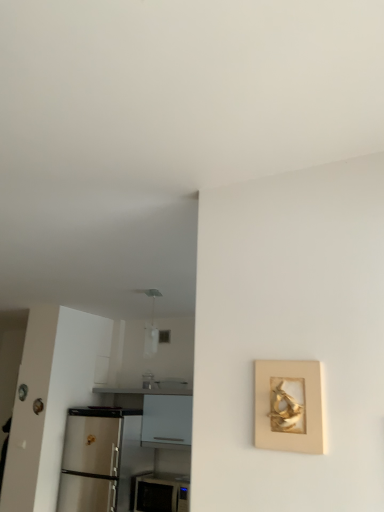
Question: Is gold textured frame at right bigger than white glossy counter at lower left?

Choices:
 (A) no
 (B) yes

Answer: (A)

Question: From the image's perspective, is gold textured frame at right on top of white glossy counter at lower left?

Choices:
 (A) yes
 (B) no

Answer: (A)

Question: Can you confirm if gold textured frame at right is positioned to the right of white glossy counter at lower left?

Choices:
 (A) no
 (B) yes

Answer: (B)

Question: Considering the relative sizes of gold textured frame at right and white glossy counter at lower left in the image provided, is gold textured frame at right wider than white glossy counter at lower left?

Choices:
 (A) no
 (B) yes

Answer: (A)

Question: Is gold textured frame at right positioned behind white glossy counter at lower left?

Choices:
 (A) no
 (B) yes

Answer: (A)

Question: Is gold textured frame at right positioned before white glossy counter at lower left?

Choices:
 (A) yes
 (B) no

Answer: (A)

Question: Is the surface of gold textured frame at right in direct contact with white glossy microwave at lower center?

Choices:
 (A) yes
 (B) no

Answer: (B)

Question: Is gold textured frame at right outside of white glossy microwave at lower center?

Choices:
 (A) no
 (B) yes

Answer: (B)

Question: From a real-world perspective, is gold textured frame at right on top of white glossy microwave at lower center?

Choices:
 (A) no
 (B) yes

Answer: (B)

Question: Is gold textured frame at right in front of white glossy microwave at lower center?

Choices:
 (A) no
 (B) yes

Answer: (B)

Question: Does gold textured frame at right appear on the right side of white glossy microwave at lower center?

Choices:
 (A) no
 (B) yes

Answer: (B)

Question: Can you confirm if gold textured frame at right is thinner than white glossy microwave at lower center?

Choices:
 (A) yes
 (B) no

Answer: (A)

Question: From the image's perspective, would you say white glossy microwave at lower center is shown under gold textured frame at right?

Choices:
 (A) no
 (B) yes

Answer: (B)